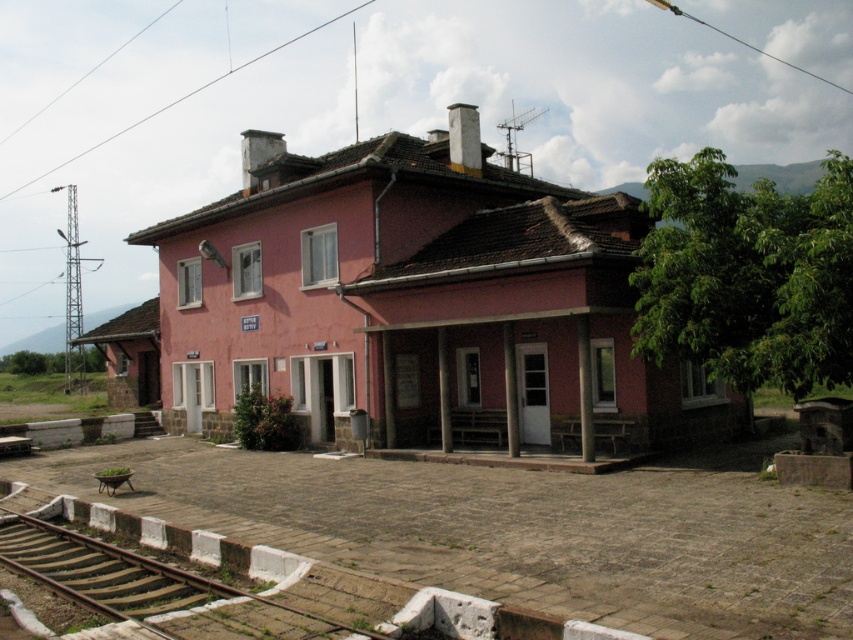
Which is below, pink brick building at center or brown wooden train track at lower left?

Positioned lower is brown wooden train track at lower left.

Is pink brick building at center further to camera compared to brown wooden train track at lower left?

Yes, it is behind brown wooden train track at lower left.

At what (x,y) coordinates should I click in order to perform the action: click on pink brick building at center. Please return your answer as a coordinate pair (x, y). The width and height of the screenshot is (853, 640). Looking at the image, I should click on (419, 304).